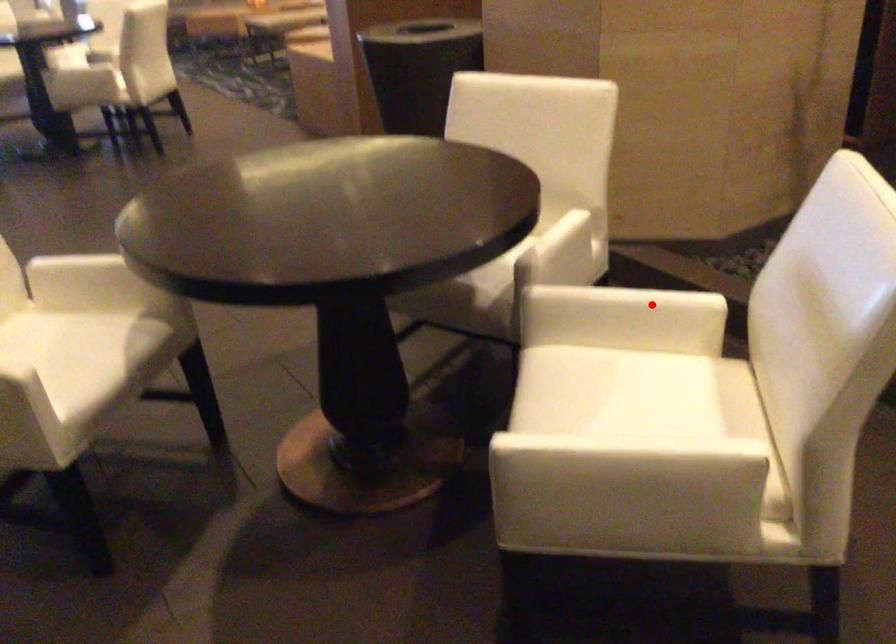
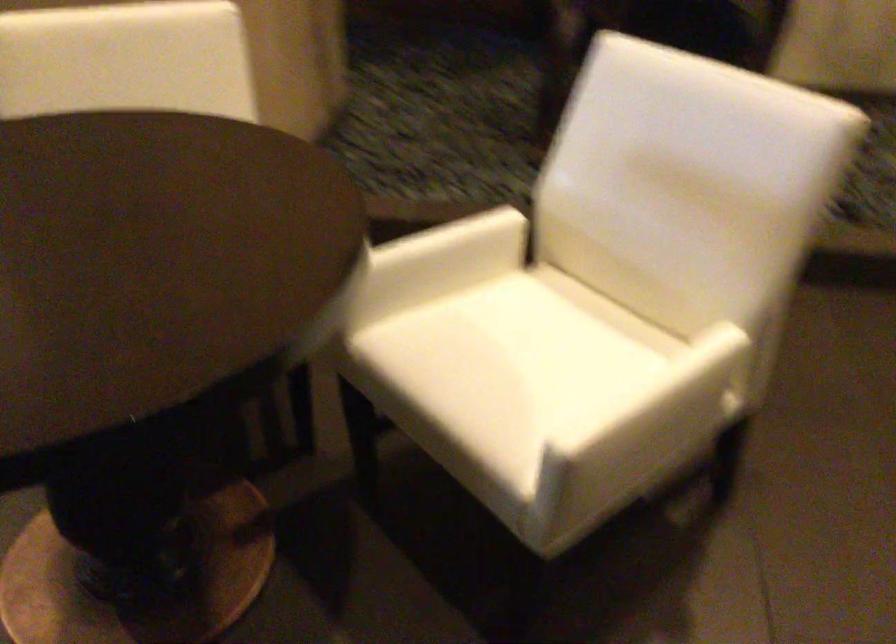
Find the pixel in the second image that matches the highlighted location in the first image.

(468, 239)